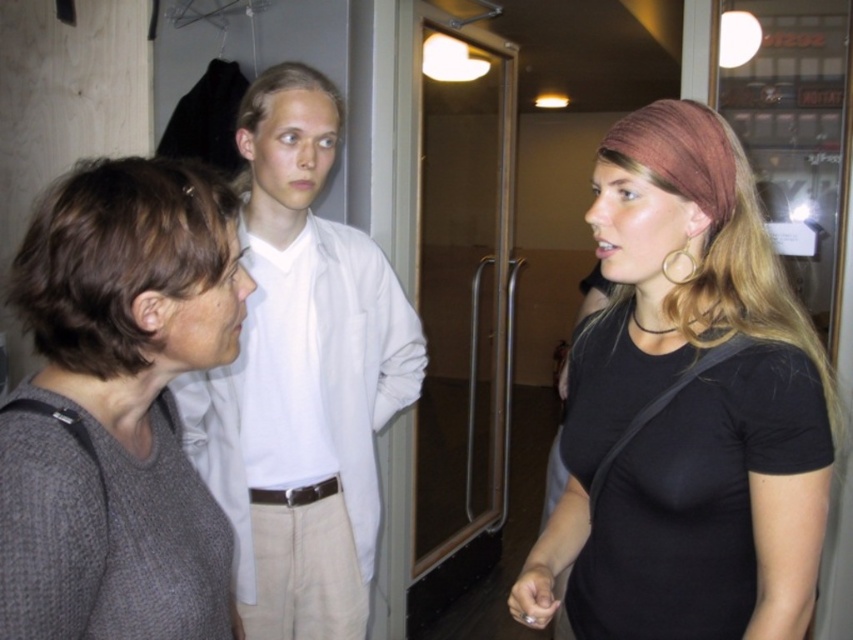
You are a delivery person trying to deliver a package to the apartment. You see the black matte shirt at right and the transparent glass door at center. Which object is wider?

The black matte shirt at right is wider than the transparent glass door at center according to the description.

You are standing in the hallway and need to exit through the transparent glass door at center. There is a person wearing a black matte shirt at right blocking your path. Can you walk around them without moving the person?

The black matte shirt at right occupies less space than the transparent glass door at center, so yes, you can walk around them since the person takes up less area and there is enough space to navigate around them towards the door.

You are standing in the hallway and see the white matte shirt at center and the transparent glass door at center. Which object is closer to you?

The white matte shirt at center is closer to you because it is in front of the transparent glass door at center.